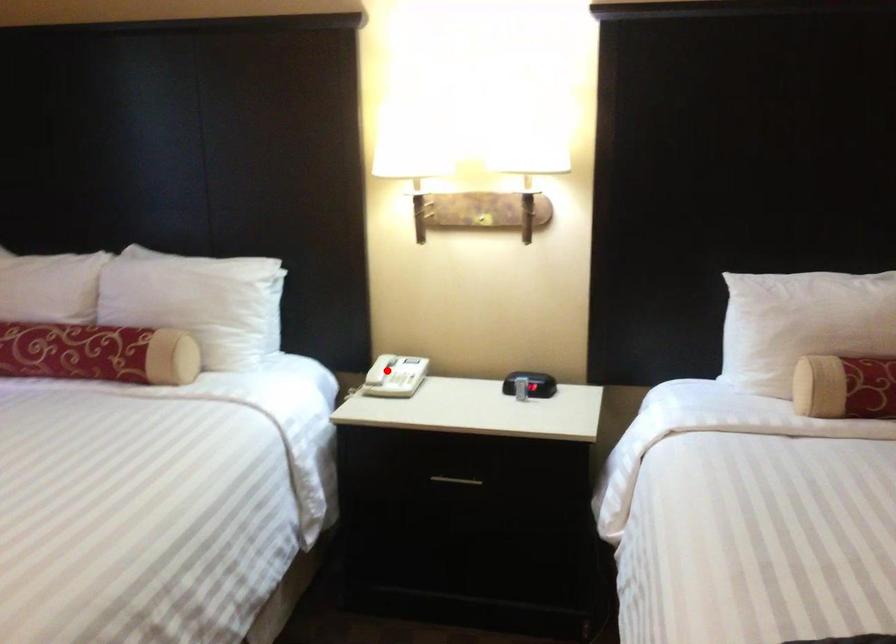
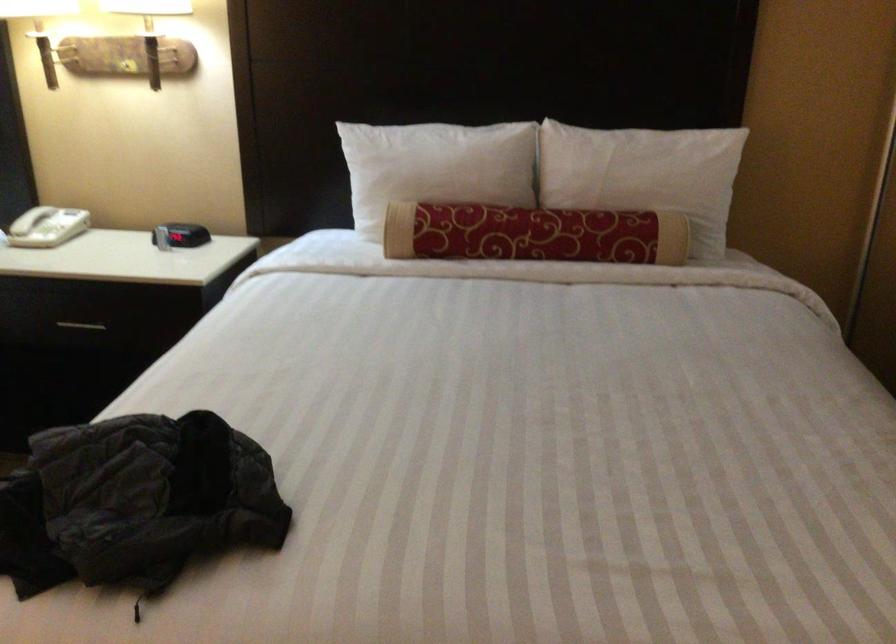
Find the pixel in the second image that matches the highlighted location in the first image.

(30, 220)